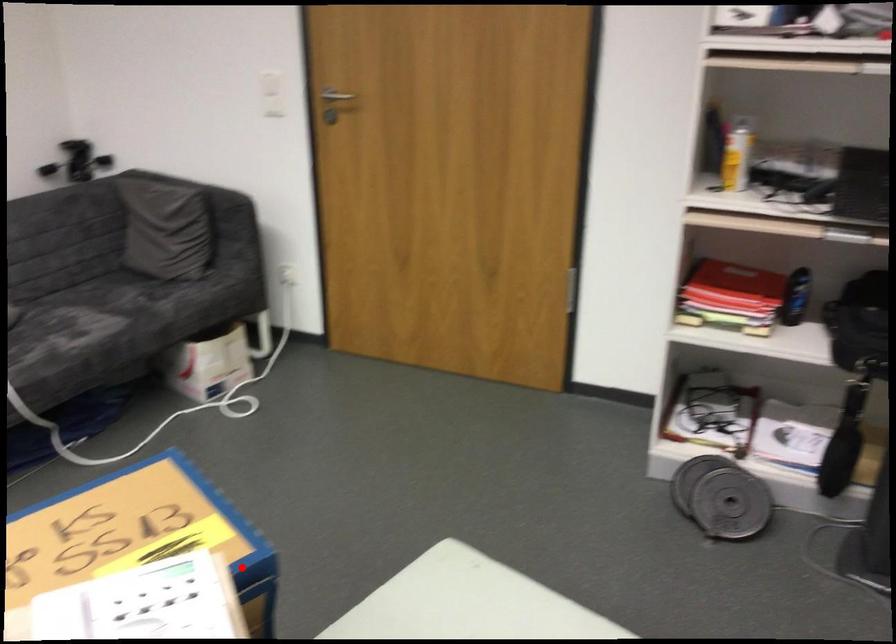
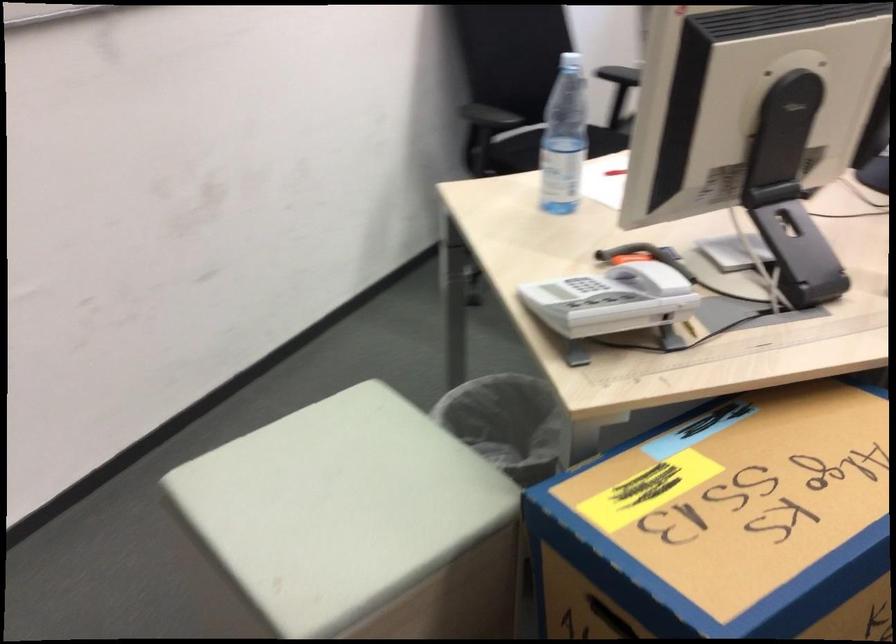
Question: I am providing you with two images of the same scene from different viewpoints. A red point is marked on the first image. At the location where the point appears in image 1, is it still visible in image 2?

Choices:
 (A) Yes
 (B) No

Answer: (A)